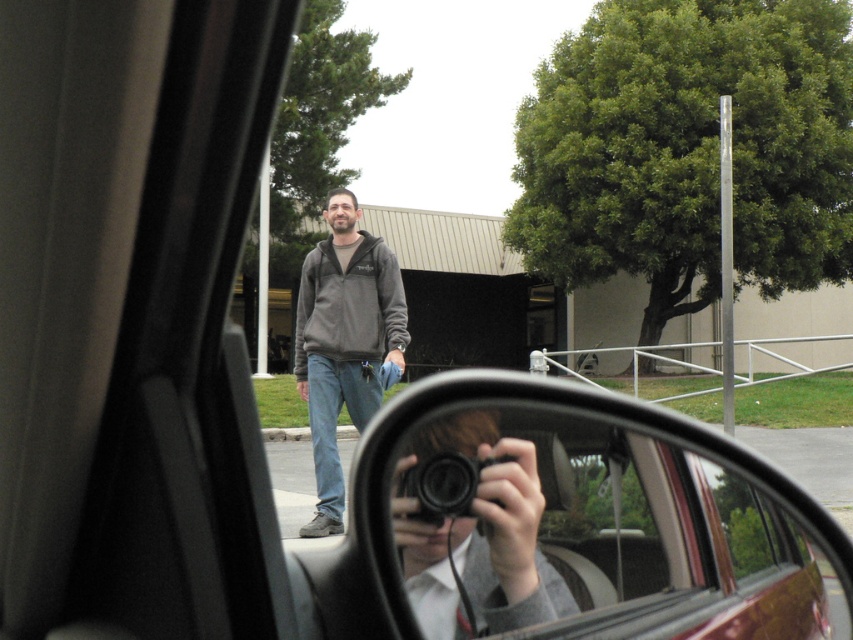
Who is shorter, shiny black mirror at center or black plastic camera at center?

black plastic camera at center is shorter.

Does shiny black mirror at center appear on the left side of black plastic camera at center?

In fact, shiny black mirror at center is to the right of black plastic camera at center.

Locate an element on the screen. This screenshot has height=640, width=853. shiny black mirror at center is located at coordinates [x=584, y=522].

Who is higher up, dark gray hoodie at center or black plastic camera at center?

black plastic camera at center

Is dark gray hoodie at center above black plastic camera at center?

Result: Actually, dark gray hoodie at center is below black plastic camera at center.

What do you see at coordinates (344, 340) in the screenshot? I see `dark gray hoodie at center` at bounding box center [344, 340].

Find the location of `dark gray hoodie at center`. dark gray hoodie at center is located at coordinates (344, 340).

Between shiny black mirror at center and dark gray hoodie at center, which one appears on the right side from the viewer's perspective?

shiny black mirror at center

Is point (363, 468) behind point (318, 424)?

That is False.

The width and height of the screenshot is (853, 640). I want to click on shiny black mirror at center, so click(584, 522).